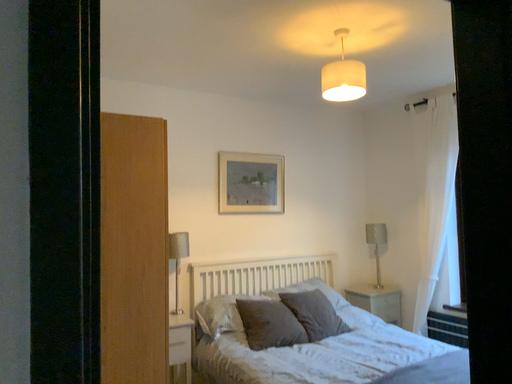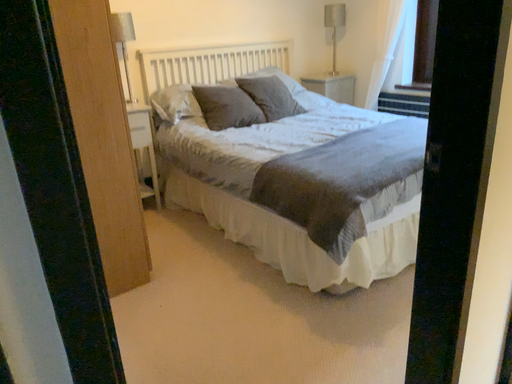
Question: Which way did the camera rotate in the video?

Choices:
 (A) rotated left
 (B) rotated right

Answer: (B)